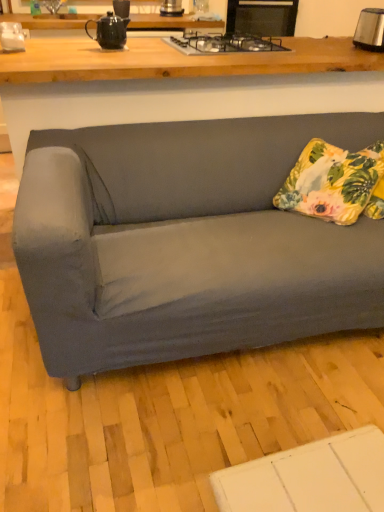
Find the location of a particular element. The image size is (384, 512). vacant area to the left of satin silver toaster at upper right is located at coordinates (339, 42).